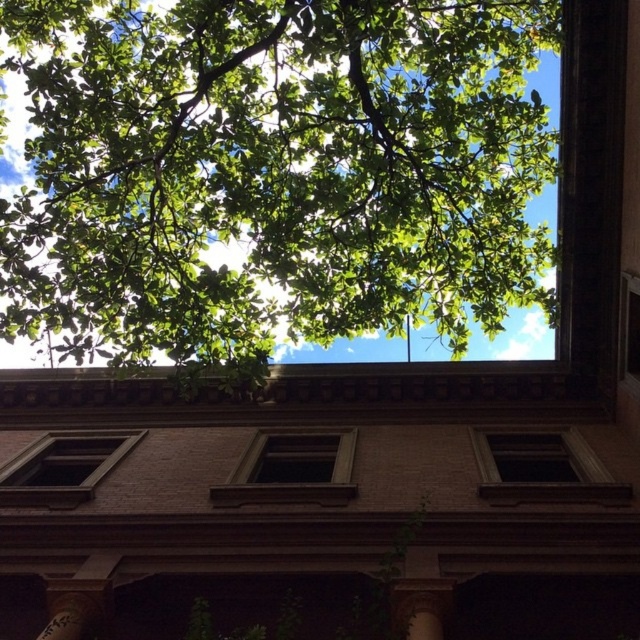
Does green leafy tree at upper center appear on the right side of brown wooden window at center?

No, green leafy tree at upper center is not to the right of brown wooden window at center.

Does point (394, 300) come in front of point (348, 474)?

Yes, it is in front of point (348, 474).

Locate an element on the screen. green leafy tree at upper center is located at coordinates (273, 172).

Between point (509, 444) and point (65, 488), which one is positioned behind?

The point (509, 444) is behind.

Can you confirm if transparent glass window at center is wider than matte brown window at center?

In fact, transparent glass window at center might be narrower than matte brown window at center.

Between point (580, 442) and point (65, 477), which one is positioned in front?

Positioned in front is point (580, 442).

The height and width of the screenshot is (640, 640). I want to click on transparent glass window at center, so tap(541, 468).

Consider the image. Does transparent glass window at center have a greater width compared to brown wooden window at center?

In fact, transparent glass window at center might be narrower than brown wooden window at center.

Is transparent glass window at center in front of brown wooden window at center?

Yes, it is in front of brown wooden window at center.

Where is `transparent glass window at center`? transparent glass window at center is located at coordinates (541, 468).